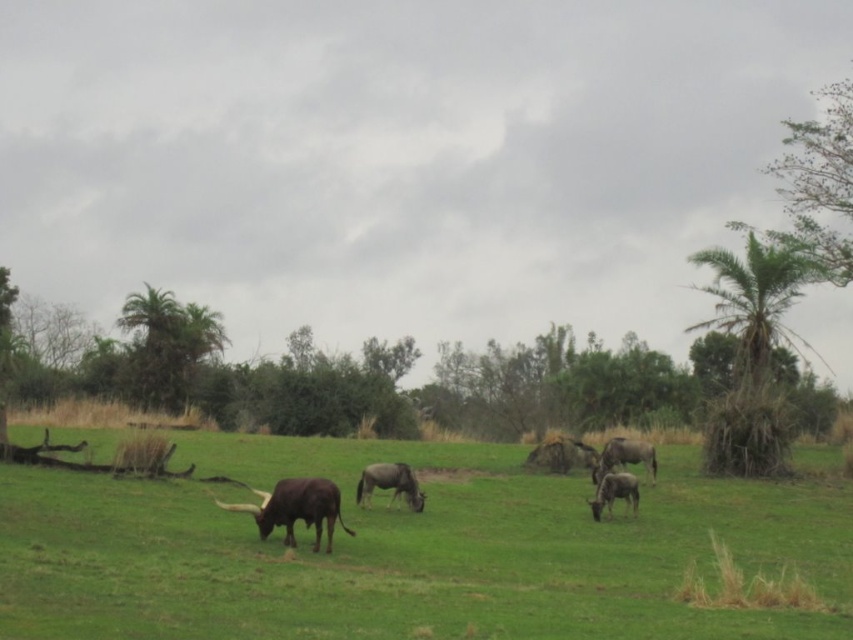
Between point (616, 460) and point (613, 497), which one is positioned in front?

Point (613, 497) is in front.

Does brown glossy antelope at center-right have a greater height compared to gray matte/glossy wildebeest at center?

No.

Who is more forward, (637, 445) or (634, 496)?

Point (634, 496) is more forward.

At what (x,y) coordinates should I click in order to perform the action: click on brown glossy antelope at center-right. Please return your answer as a coordinate pair (x, y). Looking at the image, I should click on (624, 456).

Which is in front, point (657, 552) or point (785, 442)?

Positioned in front is point (657, 552).

How distant is green grass pasture at center from green leafy palm at right?

They are 8.30 meters apart.

At what (x,y) coordinates should I click in order to perform the action: click on green grass pasture at center. Please return your answer as a coordinate pair (x, y). Looking at the image, I should click on pyautogui.click(x=405, y=552).

Who is taller, green grass pasture at center or brown glossy antelope at center?

Standing taller between the two is green grass pasture at center.

Locate an element on the screen. This screenshot has width=853, height=640. green grass pasture at center is located at coordinates (405, 552).

Find the location of a particular element. Image resolution: width=853 pixels, height=640 pixels. green grass pasture at center is located at coordinates (405, 552).